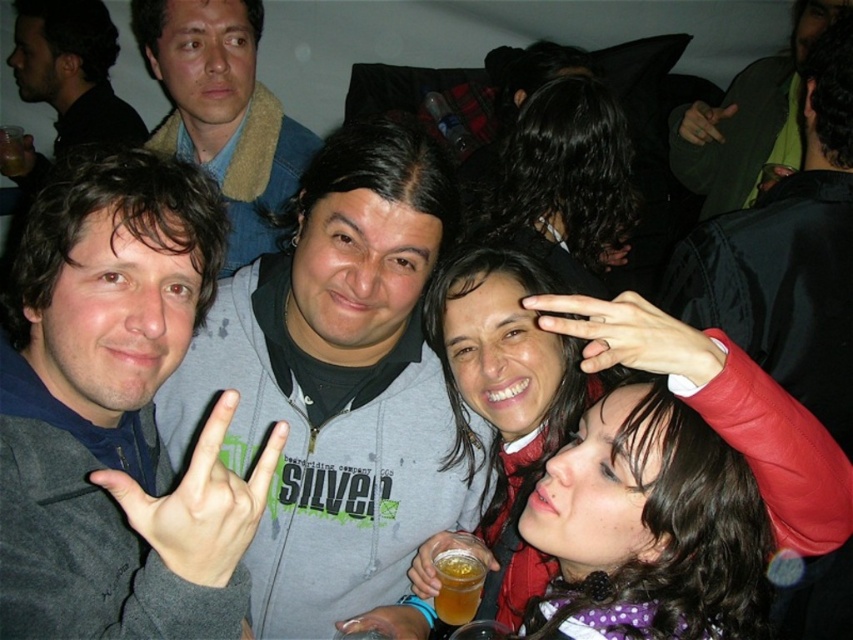
Who is lower down, gray zip-up hoodie at center or translucent plastic cup at center?

translucent plastic cup at center is below.

Based on the photo, is gray zip-up hoodie at center to the left of translucent plastic cup at center from the viewer's perspective?

Correct, you'll find gray zip-up hoodie at center to the left of translucent plastic cup at center.

The image size is (853, 640). In order to click on gray zip-up hoodie at center in this screenshot , I will do `click(337, 384)`.

Describe the element at coordinates (788, 253) in the screenshot. This screenshot has width=853, height=640. I see `black matte jacket at upper right` at that location.

Does point (821, 148) come behind point (462, 540)?

That is True.

I want to click on black matte jacket at upper right, so coord(788,253).

Based on the photo, who is positioned more to the left, blue denim jacket at upper left or matte gray hoodie at center?

Positioned to the left is matte gray hoodie at center.

Based on the photo, does blue denim jacket at upper left have a lesser height compared to matte gray hoodie at center?

Indeed, blue denim jacket at upper left has a lesser height compared to matte gray hoodie at center.

You are a GUI agent. You are given a task and a screenshot of the screen. Output one action in this format:
    pyautogui.click(x=<x>, y=<y>)
    Task: Click on the blue denim jacket at upper left
    The width and height of the screenshot is (853, 640).
    Given the screenshot: What is the action you would take?
    pyautogui.click(x=223, y=109)